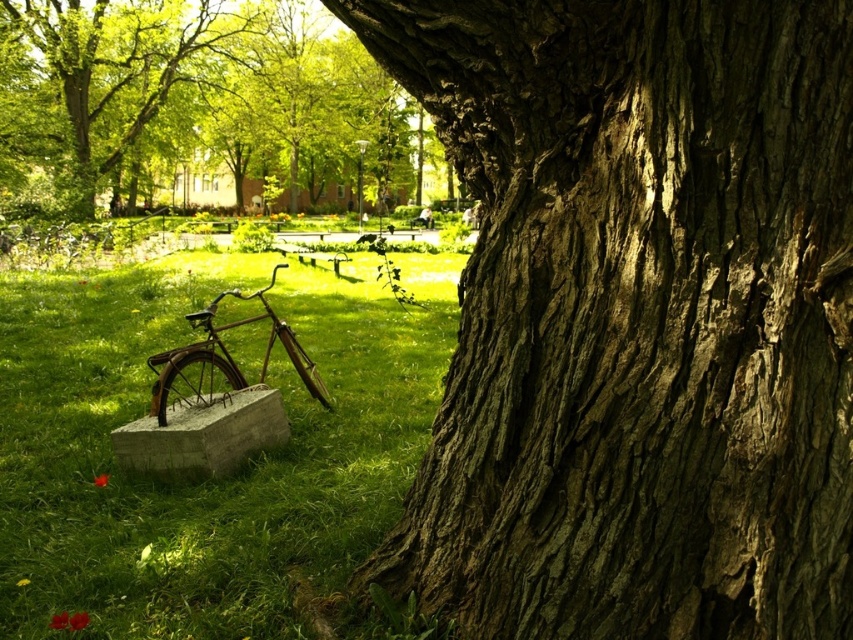
You are standing at the point with coordinates point (x=7, y=157) and want to walk to the point with coordinates point (x=328, y=400). Which direction should you move to get closer to your destination?

Since point (x=7, y=157) is behind point (x=328, y=400), you should move forward to get closer to your destination.

You are a painter setting up an easel in the park. You want to paint the rough bark tree trunk at center and the green grass at lower left. Which object should you focus on first if you want to paint the taller one first?

The rough bark tree trunk at center is taller than the green grass at lower left, so you should focus on painting the rough bark tree trunk at center first.

You are planning to place a new bench in the park. The bench requires a space wider than the rusty metal bicycle at lower left. Based on the scene, is the rough bark tree trunk at center a suitable location for placing the bench?

The rough bark tree trunk at center has a width larger than the rusty metal bicycle at lower left, so it provides sufficient space for the bench that requires a wider area than the bicycle.